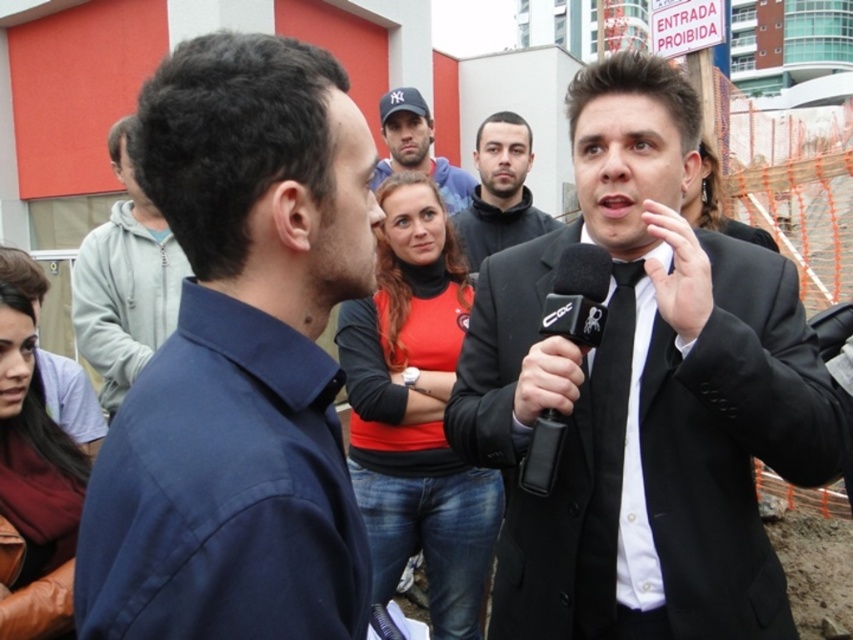
Between matte black suit at center and black plastic microphone at center, which one appears on the left side from the viewer's perspective?

Positioned to the left is black plastic microphone at center.

Is matte black suit at center to the left of black plastic microphone at center from the viewer's perspective?

No, matte black suit at center is not to the left of black plastic microphone at center.

Between point (491, 184) and point (556, 291), which one is positioned in front?

Point (556, 291) is more forward.

Where is `matte black suit at center`? matte black suit at center is located at coordinates (500, 192).

Does leather jacket at lower left have a lesser width compared to matte black cap at upper center?

Yes.

Can you confirm if leather jacket at lower left is smaller than matte black cap at upper center?

Yes.

Is point (9, 349) closer to camera compared to point (444, 202)?

That is True.

Where is `leather jacket at lower left`? leather jacket at lower left is located at coordinates (33, 486).

Does blue shirt at left have a smaller size compared to black plastic microphone at center?

Incorrect, blue shirt at left is not smaller in size than black plastic microphone at center.

This screenshot has width=853, height=640. Identify the location of blue shirt at left. (239, 362).

Measure the distance between point [260,492] and camera.

35.56 inches

Where is `blue shirt at left`? blue shirt at left is located at coordinates (239, 362).